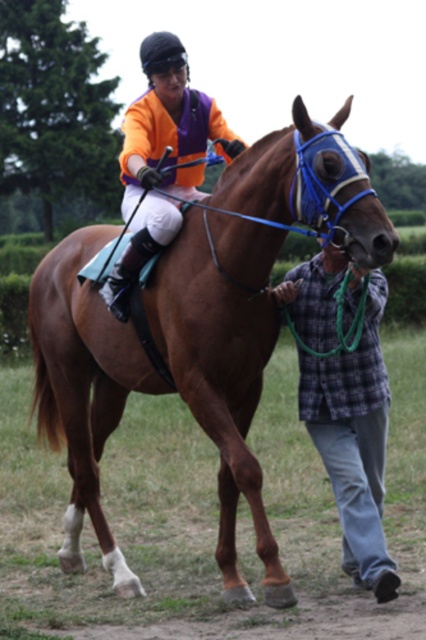
You are a photographer standing in the middle of the scene. You want to take a photo that includes both point (247, 413) and point (144, 202). Which point will appear closer to the front of the photo?

Point (247, 413) is further to the viewer than point (144, 202), so in the photo, point (247, 413) will appear closer to the front of the photo.

You are a photographer trying to capture a closeup of the brown glossy horse at center and the plaid flannel shirt at lower right in the scene. Since you want both subjects to be in focus, which one should you focus on first to ensure the other is also in focus?

The brown glossy horse at center is larger in size than the plaid flannel shirt at lower right, so you should focus on the brown glossy horse at center first to ensure both are in focus.